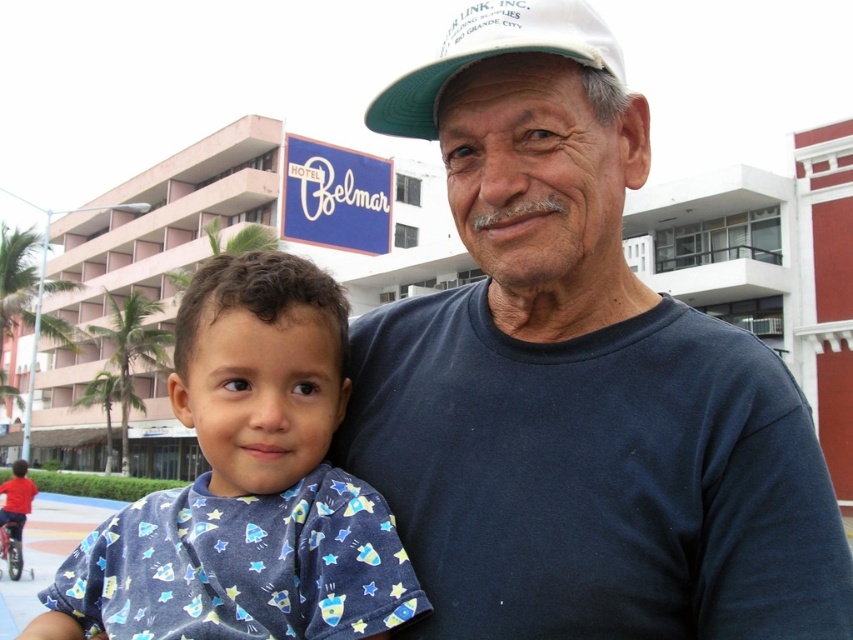
Can you confirm if dark blue t-shirt at center is shorter than white fabric baseball cap at upper center?

Incorrect, dark blue t-shirt at center's height does not fall short of white fabric baseball cap at upper center's.

Looking at this image, can you confirm if dark blue t-shirt at center is bigger than white fabric baseball cap at upper center?

Indeed, dark blue t-shirt at center has a larger size compared to white fabric baseball cap at upper center.

Is point (650, 308) in front of point (375, 100)?

No, it is behind (375, 100).

This screenshot has height=640, width=853. What are the coordinates of `dark blue t-shirt at center` in the screenshot? It's located at (577, 380).

This screenshot has height=640, width=853. Identify the location of blue cotton shirt at lower left. (247, 484).

Who is more forward, (x=73, y=620) or (x=599, y=60)?

Positioned in front is point (x=599, y=60).

The height and width of the screenshot is (640, 853). I want to click on blue cotton shirt at lower left, so click(x=247, y=484).

Who is taller, dark blue t-shirt at center or blue cotton shirt at lower left?

Standing taller between the two is dark blue t-shirt at center.

What do you see at coordinates (577, 380) in the screenshot?
I see `dark blue t-shirt at center` at bounding box center [577, 380].

Between point (697, 317) and point (283, 584), which one is positioned behind?

The point (697, 317) is behind.

This screenshot has width=853, height=640. I want to click on dark blue t-shirt at center, so 577,380.